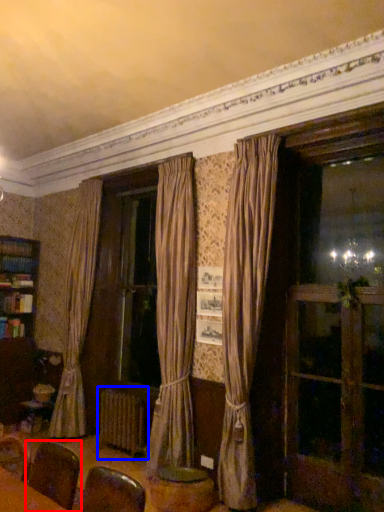
Question: Which object appears closest to the camera in this image, armchair (highlighted by a red box) or radiator (highlighted by a blue box)?

Choices:
 (A) armchair
 (B) radiator

Answer: (A)